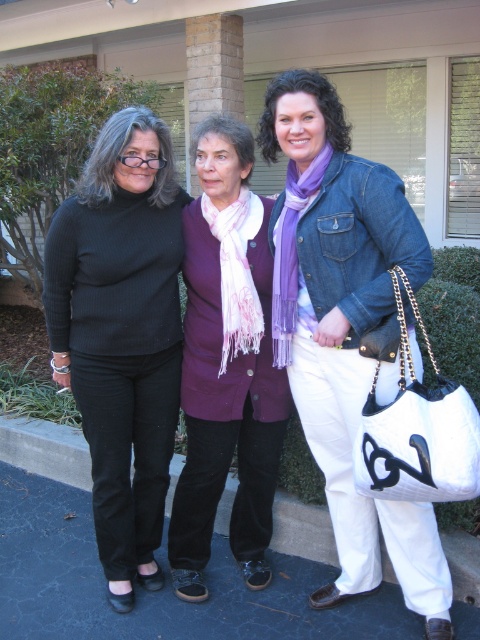
You are standing in front of the building and want to pick up the denim jacket at center. Which direction should you move relative to the middle woman?

The denim jacket at center is located at point coordinates, so you should move towards the middle woman to reach it.

You are a fashion designer observing the women in the image. Which clothing item is positioned higher on the body between the ribbed black sweater at left and the purple cotton scarf at center?

The ribbed black sweater at left is located above the purple cotton scarf at center, so it is positioned higher on the body.